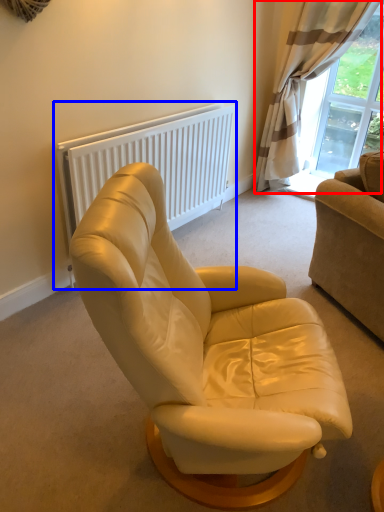
Question: Which point is further to the camera, curtain (highlighted by a red box) or radiator (highlighted by a blue box)?

Choices:
 (A) curtain
 (B) radiator

Answer: (A)